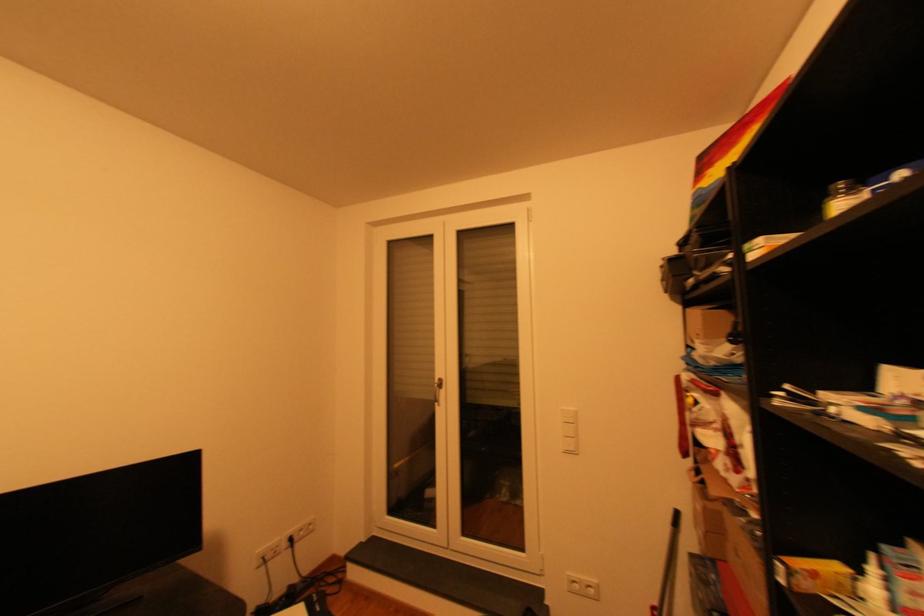
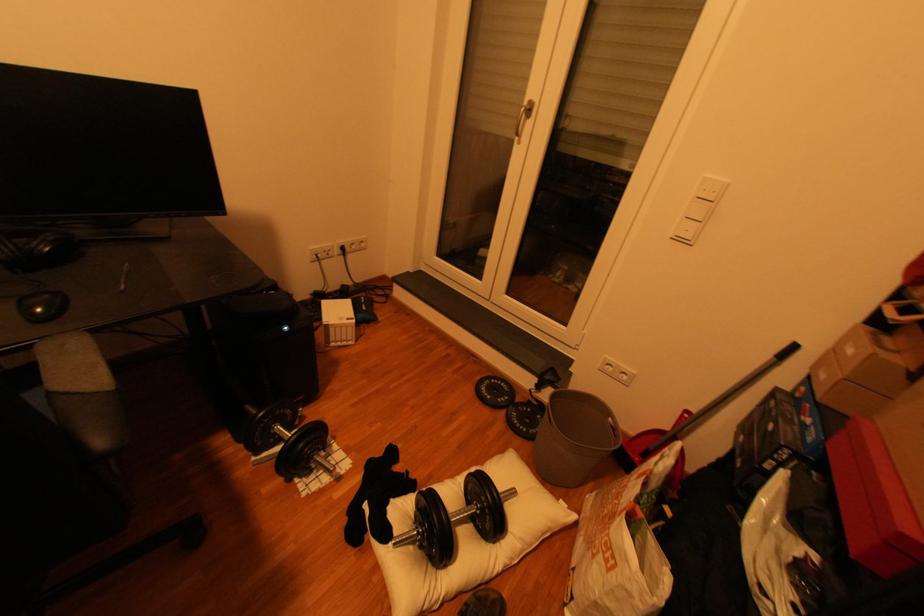
Question: The images are taken continuously from a first-person perspective. In which direction is your viewpoint rotating?

Choices:
 (A) Left
 (B) Right
 (C) Up
 (D) Down

Answer: (D)